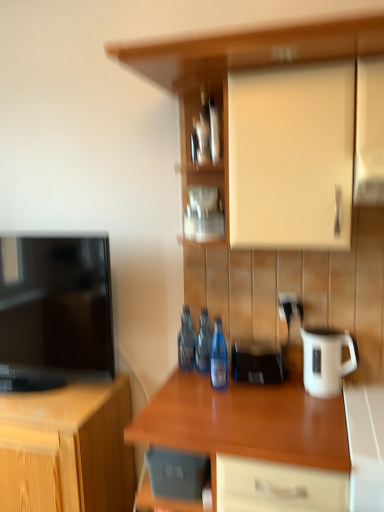
Question: Which direction should I rotate to face matte wood cabinet at upper center, the 2th cabinetry positioned from the bottom, — up or down?

Choices:
 (A) up
 (B) down

Answer: (A)

Question: Does glossy wood countertop at center have a lesser height compared to blue glass bottle at center, which ranks as the 1th bottle in front-to-back order?

Choices:
 (A) yes
 (B) no

Answer: (B)

Question: Is glossy wood countertop at center oriented towards blue glass bottle at center, which ranks as the 1th bottle in front-to-back order?

Choices:
 (A) yes
 (B) no

Answer: (B)

Question: Is the depth of glossy wood countertop at center less than that of blue glass bottle at center, which ranks as the 1th bottle in front-to-back order?

Choices:
 (A) yes
 (B) no

Answer: (A)

Question: Is glossy wood countertop at center to the left of blue glass bottle at center, which ranks as the 1th bottle in front-to-back order, from the viewer's perspective?

Choices:
 (A) no
 (B) yes

Answer: (A)

Question: Considering the relative sizes of glossy wood countertop at center and blue glass bottle at center, which ranks as the 1th bottle in front-to-back order, in the image provided, is glossy wood countertop at center smaller than blue glass bottle at center, which ranks as the 1th bottle in front-to-back order,?

Choices:
 (A) yes
 (B) no

Answer: (B)

Question: From a real-world perspective, is glossy wood countertop at center physically below blue glass bottle at center, which ranks as the 1th bottle in front-to-back order?

Choices:
 (A) no
 (B) yes

Answer: (B)

Question: From a real-world perspective, is white glossy counter at lower right physically below metallic silver frame at center, the 1th shelf in the back-to-front sequence?

Choices:
 (A) yes
 (B) no

Answer: (A)

Question: Is white glossy counter at lower right bigger than metallic silver frame at center, the 1th shelf in the back-to-front sequence?

Choices:
 (A) no
 (B) yes

Answer: (B)

Question: From the image's perspective, is white glossy counter at lower right above metallic silver frame at center, the 1th shelf in the back-to-front sequence?

Choices:
 (A) yes
 (B) no

Answer: (B)

Question: Can you confirm if white glossy counter at lower right is wider than metallic silver frame at center, the second shelf when ordered from front to back?

Choices:
 (A) yes
 (B) no

Answer: (A)

Question: Does white glossy counter at lower right lie in front of metallic silver frame at center, the second shelf when ordered from front to back?

Choices:
 (A) yes
 (B) no

Answer: (A)

Question: Is white glossy counter at lower right to the left of metallic silver frame at center, the 1th shelf in the back-to-front sequence, from the viewer's perspective?

Choices:
 (A) no
 (B) yes

Answer: (A)

Question: Is white glossy jug at right facing away from white glossy counter at lower right?

Choices:
 (A) no
 (B) yes

Answer: (A)